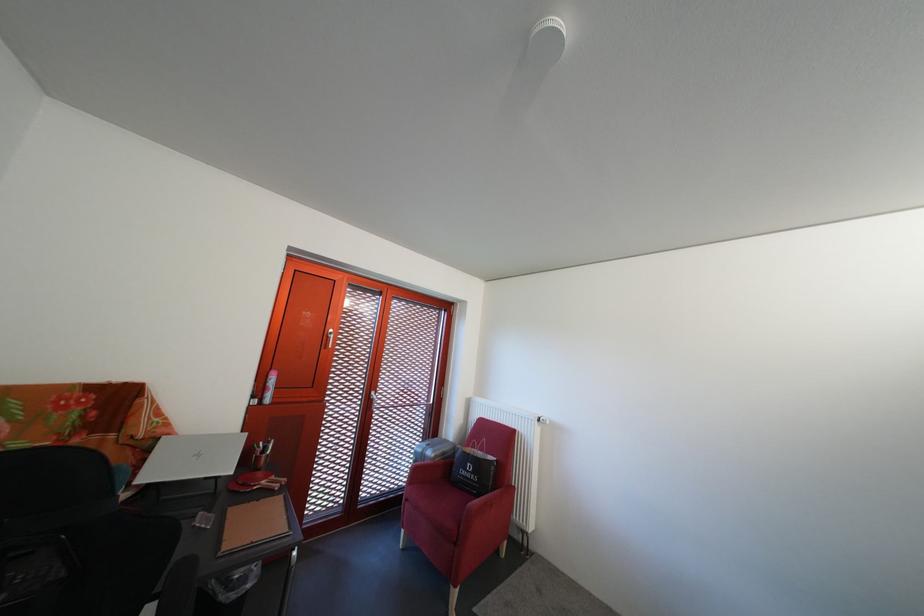
What do you see at coordinates (190, 456) in the screenshot?
I see `the silver laptop` at bounding box center [190, 456].